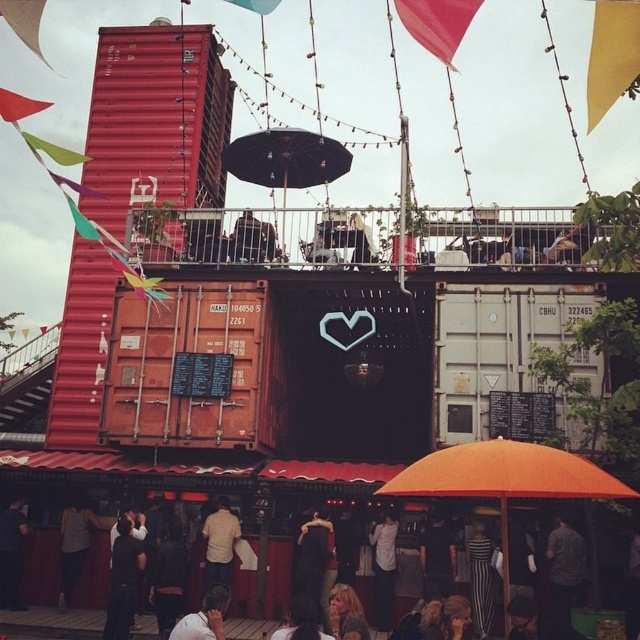
Question: Considering the relative positions of black fabric umbrella at upper center and white matte shirt at center in the image provided, where is black fabric umbrella at upper center located with respect to white matte shirt at center?

Choices:
 (A) above
 (B) below

Answer: (A)

Question: Which object is farther from the camera taking this photo?

Choices:
 (A) orange fabric umbrella at lower center
 (B) dark gray fabric jacket at lower left

Answer: (B)

Question: Estimate the real-world distances between objects in this image. Which object is closer to the red fabric flag at upper center?

Choices:
 (A) dark gray fabric jacket at lower center
 (B) black striped dress at lower center
 (C) white matte shirt at center

Answer: (B)

Question: Is black fabric umbrella at upper center to the left of dark gray fabric shirt at lower left from the viewer's perspective?

Choices:
 (A) yes
 (B) no

Answer: (B)

Question: Is dark gray fabric shirt at lower left bigger than black striped dress at lower center?

Choices:
 (A) no
 (B) yes

Answer: (B)

Question: Which of the following is the farthest from the observer?

Choices:
 (A) red fabric flag at upper center
 (B) dark gray fabric shirt at lower left
 (C) dark gray fabric jacket at lower left
 (D) dark gray fabric jacket at lower right

Answer: (B)